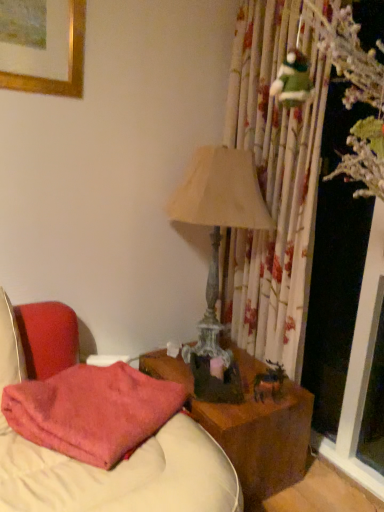
I want to click on pink fuzzy pillow at lower left, so click(92, 411).

Locate an element on the screen. wooden nightstand at center is located at coordinates click(249, 425).

Find the location of `pink fuzzy pillow at lower left`. pink fuzzy pillow at lower left is located at coordinates (92, 411).

What's the angular difference between pink fuzzy pillow at lower left and matte beige lampshade at center-right's facing directions?

The angular difference between pink fuzzy pillow at lower left and matte beige lampshade at center-right is 46.5 degrees.

Between pink fuzzy pillow at lower left and matte beige lampshade at center-right, which one has larger size?

matte beige lampshade at center-right.

Which object is further away from the camera taking this photo, pink fuzzy pillow at lower left or matte beige lampshade at center-right?

matte beige lampshade at center-right is behind.

From a real-world perspective, relative to matte beige lampshade at center-right, is pink fuzzy pillow at lower left vertically above or below?

From a real-world perspective, pink fuzzy pillow at lower left is physically below matte beige lampshade at center-right.

From the picture: Can you confirm if matte beige lampshade at center-right is shorter than pink fuzzy pillow at lower left?

No.

Between matte beige lampshade at center-right and pink fuzzy pillow at lower left, which one appears on the right side from the viewer's perspective?

matte beige lampshade at center-right is more to the right.

Is matte beige lampshade at center-right spatially inside pink fuzzy pillow at lower left, or outside of it?

The correct answer is: outside.

Is pink fuzzy pillow at lower left at the back of matte beige lampshade at center-right?

No, matte beige lampshade at center-right's orientation is not away from pink fuzzy pillow at lower left.

Based on the photo, can you confirm if matte beige lampshade at center-right is smaller than wooden nightstand at center?

No, matte beige lampshade at center-right is not smaller than wooden nightstand at center.

In order to click on nightstand below the matte beige lampshade at center-right (from a real-world perspective) in this screenshot , I will do `click(249, 425)`.

From a real-world perspective, is matte beige lampshade at center-right on wooden nightstand at center?

Yes.

What's the angular difference between pink fuzzy pillow at lower left and wooden nightstand at center's facing directions?

The angular difference between pink fuzzy pillow at lower left and wooden nightstand at center is 29.1 degrees.

Could you tell me if pink fuzzy pillow at lower left is facing wooden nightstand at center?

No, pink fuzzy pillow at lower left is not oriented towards wooden nightstand at center.

Are pink fuzzy pillow at lower left and wooden nightstand at center beside each other?

pink fuzzy pillow at lower left is not next to wooden nightstand at center, and they're not touching.

Looking at their sizes, would you say pink fuzzy pillow at lower left is wider or thinner than wooden nightstand at center?

In the image, pink fuzzy pillow at lower left appears to be more narrow than wooden nightstand at center.

Is wooden nightstand at center bigger or smaller than matte beige lampshade at center-right?

In the image, wooden nightstand at center appears to be smaller than matte beige lampshade at center-right.

Considering the sizes of objects wooden nightstand at center and matte beige lampshade at center-right in the image provided, who is shorter, wooden nightstand at center or matte beige lampshade at center-right?

Standing shorter between the two is wooden nightstand at center.

Which point is more forward, (279, 439) or (201, 341)?

The point (279, 439) is in front.

Based on the photo, is matte beige lampshade at center-right located within wooden nightstand at center?

No, matte beige lampshade at center-right is not inside wooden nightstand at center.

From the image's perspective, is wooden nightstand at center above or below pink fuzzy pillow at lower left?

wooden nightstand at center is situated lower than pink fuzzy pillow at lower left in the image.

Is wooden nightstand at center further to the viewer compared to pink fuzzy pillow at lower left?

Yes, wooden nightstand at center is further from the camera.

Measure the distance from wooden nightstand at center to pink fuzzy pillow at lower left.

They are 13.58 inches apart.

Is wooden nightstand at center wider or thinner than pink fuzzy pillow at lower left?

wooden nightstand at center is wider than pink fuzzy pillow at lower left.

Identify the location of table lamp above the pink fuzzy pillow at lower left (from a real-world perspective). The width and height of the screenshot is (384, 512). (218, 221).

Where is `table lamp above the pink fuzzy pillow at lower left (from the image's perspective)`? The width and height of the screenshot is (384, 512). table lamp above the pink fuzzy pillow at lower left (from the image's perspective) is located at coordinates (218, 221).

From the picture: Which object lies further to the anchor point pink fuzzy pillow at lower left, wooden nightstand at center or matte beige lampshade at center-right?

matte beige lampshade at center-right is positioned further to the anchor pink fuzzy pillow at lower left.

Which object lies further to the anchor point wooden nightstand at center, pink fuzzy pillow at lower left or matte beige lampshade at center-right?

matte beige lampshade at center-right is further to wooden nightstand at center.

From the image, which object appears to be nearer to matte beige lampshade at center-right, pink fuzzy pillow at lower left or wooden nightstand at center?

The object closer to matte beige lampshade at center-right is pink fuzzy pillow at lower left.

Considering their positions, is matte beige lampshade at center-right positioned further to pink fuzzy pillow at lower left than wooden nightstand at center?

matte beige lampshade at center-right is positioned further to the anchor pink fuzzy pillow at lower left.

Which object lies nearer to the anchor point matte beige lampshade at center-right, wooden nightstand at center or pink fuzzy pillow at lower left?

pink fuzzy pillow at lower left is closer to matte beige lampshade at center-right.

From the image, which object appears to be nearer to wooden nightstand at center, matte beige lampshade at center-right or pink fuzzy pillow at lower left?

pink fuzzy pillow at lower left is positioned closer to the anchor wooden nightstand at center.

Find the location of `pillow between matte beige lampshade at center-right and wooden nightstand at center vertically`. pillow between matte beige lampshade at center-right and wooden nightstand at center vertically is located at coordinates tap(92, 411).